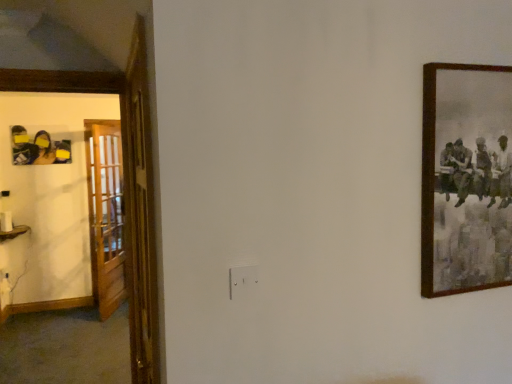
Question: Is wooden at left, acting as the 2th door starting from the right, positioned with its back to matte black photo frame at left?

Choices:
 (A) yes
 (B) no

Answer: (A)

Question: Would you say matte black photo frame at left is part of wooden at left, the first door positioned from the left,'s contents?

Choices:
 (A) no
 (B) yes

Answer: (A)

Question: Does wooden at left, the 1th door positioned from the back, appear on the right side of matte black photo frame at left?

Choices:
 (A) yes
 (B) no

Answer: (A)

Question: Can you confirm if wooden at left, the 1th door positioned from the back, is wider than matte black photo frame at left?

Choices:
 (A) no
 (B) yes

Answer: (A)

Question: Considering the relative positions of wooden at left, the 1th door positioned from the back, and matte black photo frame at left in the image provided, is wooden at left, the 1th door positioned from the back, behind matte black photo frame at left?

Choices:
 (A) yes
 (B) no

Answer: (B)

Question: Does wooden at left, the first door positioned from the left, have a greater height compared to matte black photo frame at left?

Choices:
 (A) yes
 (B) no

Answer: (A)

Question: Can you confirm if wooden at left, which is the 2th door from front to back, is thinner than wooden picture frame at right?

Choices:
 (A) yes
 (B) no

Answer: (A)

Question: Is wooden at left, which is the 2th door from front to back, positioned with its back to wooden picture frame at right?

Choices:
 (A) yes
 (B) no

Answer: (B)

Question: Does wooden at left, which is the 2th door from front to back, touch wooden picture frame at right?

Choices:
 (A) no
 (B) yes

Answer: (A)

Question: Can you confirm if wooden at left, which is the 2th door from front to back, is smaller than wooden picture frame at right?

Choices:
 (A) yes
 (B) no

Answer: (B)

Question: Is wooden at left, the 1th door positioned from the back, not close to wooden picture frame at right?

Choices:
 (A) no
 (B) yes

Answer: (B)

Question: Does wooden at left, which is the 2th door from front to back, have a lesser height compared to wooden picture frame at right?

Choices:
 (A) no
 (B) yes

Answer: (A)

Question: Is matte black photo frame at left outside wooden picture frame at right?

Choices:
 (A) no
 (B) yes

Answer: (B)